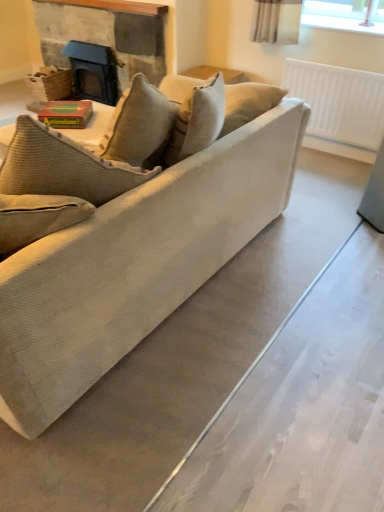
Question: Can you confirm if white plastic radiator at upper right is positioned to the left of yellow-green cardboard book at center?

Choices:
 (A) yes
 (B) no

Answer: (B)

Question: Is white plastic radiator at upper right not near yellow-green cardboard book at center?

Choices:
 (A) no
 (B) yes

Answer: (B)

Question: From a real-world perspective, is white plastic radiator at upper right over yellow-green cardboard book at center?

Choices:
 (A) yes
 (B) no

Answer: (B)

Question: Can you confirm if white plastic radiator at upper right is positioned to the right of yellow-green cardboard book at center?

Choices:
 (A) yes
 (B) no

Answer: (A)

Question: Is the position of white plastic radiator at upper right more distant than that of yellow-green cardboard book at center?

Choices:
 (A) no
 (B) yes

Answer: (B)

Question: From the image's perspective, is matte black fireplace at upper left positioned above or below white plastic radiator at upper right?

Choices:
 (A) above
 (B) below

Answer: (A)

Question: Considering the positions of matte black fireplace at upper left and white plastic radiator at upper right in the image, is matte black fireplace at upper left bigger or smaller than white plastic radiator at upper right?

Choices:
 (A) big
 (B) small

Answer: (A)

Question: Looking at their shapes, would you say matte black fireplace at upper left is wider or thinner than white plastic radiator at upper right?

Choices:
 (A) wide
 (B) thin

Answer: (A)

Question: From a real-world perspective, is matte black fireplace at upper left physically located above or below white plastic radiator at upper right?

Choices:
 (A) below
 (B) above

Answer: (B)

Question: Is point (134, 297) closer or farther from the camera than point (350, 97)?

Choices:
 (A) closer
 (B) farther

Answer: (A)

Question: From a real-world perspective, is beige corduroy couch at center physically located above or below white plastic radiator at upper right?

Choices:
 (A) above
 (B) below

Answer: (A)

Question: Looking at their shapes, would you say beige corduroy couch at center is wider or thinner than white plastic radiator at upper right?

Choices:
 (A) thin
 (B) wide

Answer: (B)

Question: Is beige corduroy couch at center taller or shorter than white plastic radiator at upper right?

Choices:
 (A) short
 (B) tall

Answer: (B)

Question: In the image, is matte black fireplace at upper left on the left side or the right side of beige corduroy couch at center?

Choices:
 (A) right
 (B) left

Answer: (B)

Question: From the image's perspective, is matte black fireplace at upper left above or below beige corduroy couch at center?

Choices:
 (A) above
 (B) below

Answer: (A)